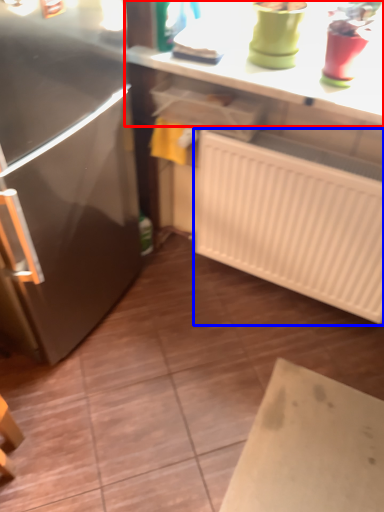
Question: Which object is closer to the camera taking this photo, countertop (highlighted by a red box) or radiator (highlighted by a blue box)?

Choices:
 (A) countertop
 (B) radiator

Answer: (A)